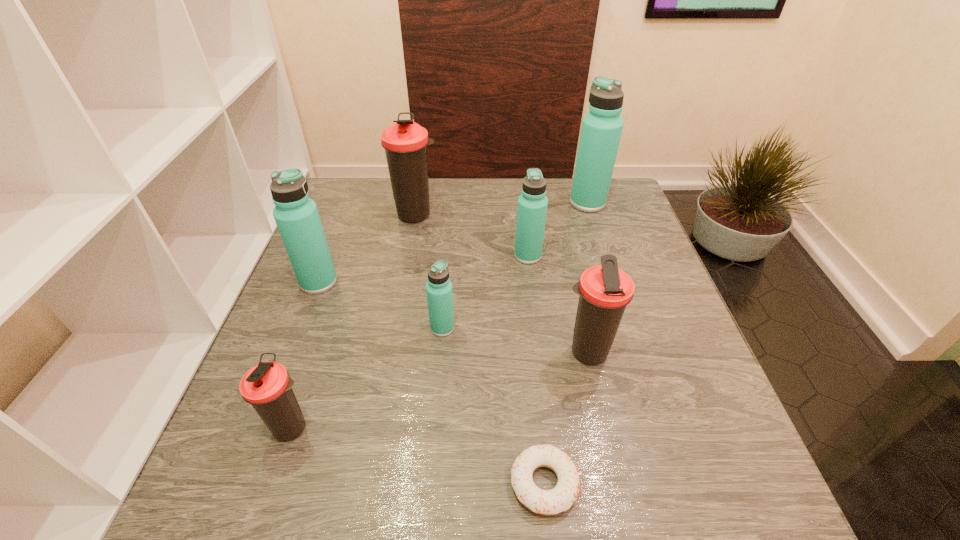
This screenshot has height=540, width=960. I want to click on the biggest aqua thermos bottle, so click(601, 130).

Identify the location of the tallest object. This screenshot has width=960, height=540. tap(601, 130).

What are the coordinates of `the fifth thermos bottle from right to left` in the screenshot? It's located at (405, 142).

Image resolution: width=960 pixels, height=540 pixels. What are the coordinates of `the third object from left to right` in the screenshot? It's located at (405, 142).

At what (x,y) coordinates should I click in order to perform the action: click on the leftmost aqua thermos bottle. Please return your answer as a coordinate pair (x, y). The width and height of the screenshot is (960, 540). Looking at the image, I should click on (297, 218).

Identify the location of the third smallest aqua thermos bottle. tap(297, 218).

You are a GUI agent. You are given a task and a screenshot of the screen. Output one action in this format:
    pyautogui.click(x=<x>, y=<y>)
    Task: Click on the fifth thermos bottle from left to right
    This screenshot has width=960, height=540.
    Given the screenshot: What is the action you would take?
    pyautogui.click(x=532, y=206)

This screenshot has height=540, width=960. I want to click on the third farthest thermos bottle, so click(x=532, y=206).

This screenshot has width=960, height=540. Find the location of `the second nearest brown thermos bottle`. the second nearest brown thermos bottle is located at coordinates (605, 291).

Locate an element on the screen. the second biggest brown thermos bottle is located at coordinates (605, 291).